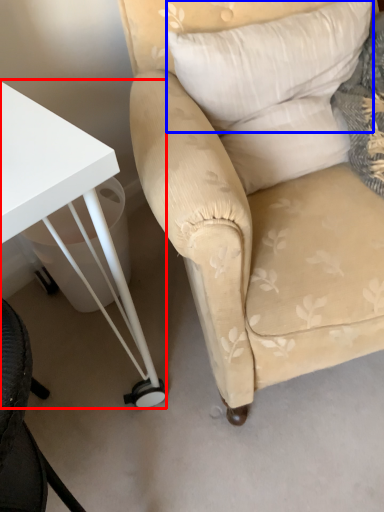
Question: Which of the following is the farthest to the observer, table (highlighted by a red box) or pillow (highlighted by a blue box)?

Choices:
 (A) table
 (B) pillow

Answer: (B)